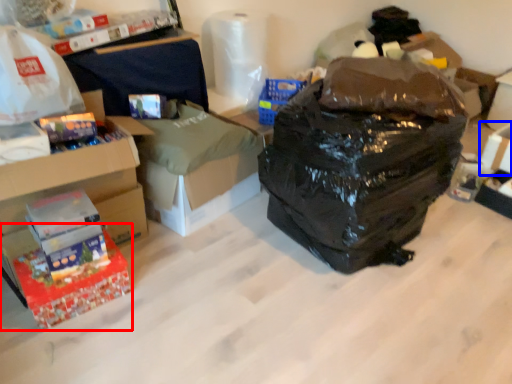
Question: Which object is closer to the camera taking this photo, box (highlighted by a red box) or storage box (highlighted by a blue box)?

Choices:
 (A) box
 (B) storage box

Answer: (A)